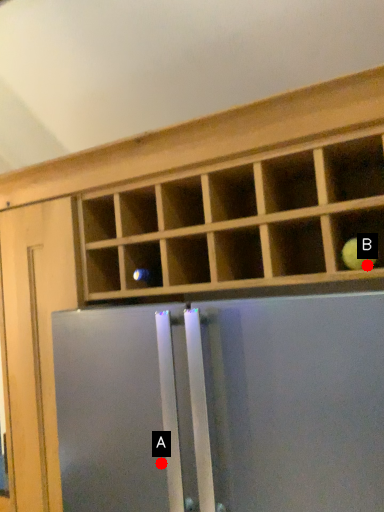
Question: Two points are circled on the image, labeled by A and B beside each circle. Which point appears closest to the camera in this image?

Choices:
 (A) A is closer
 (B) B is closer

Answer: (B)